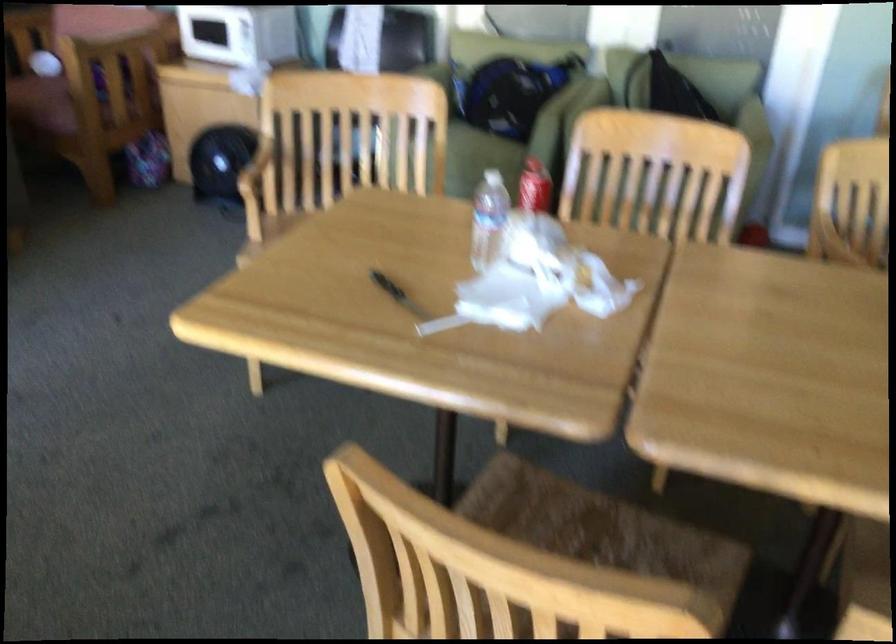
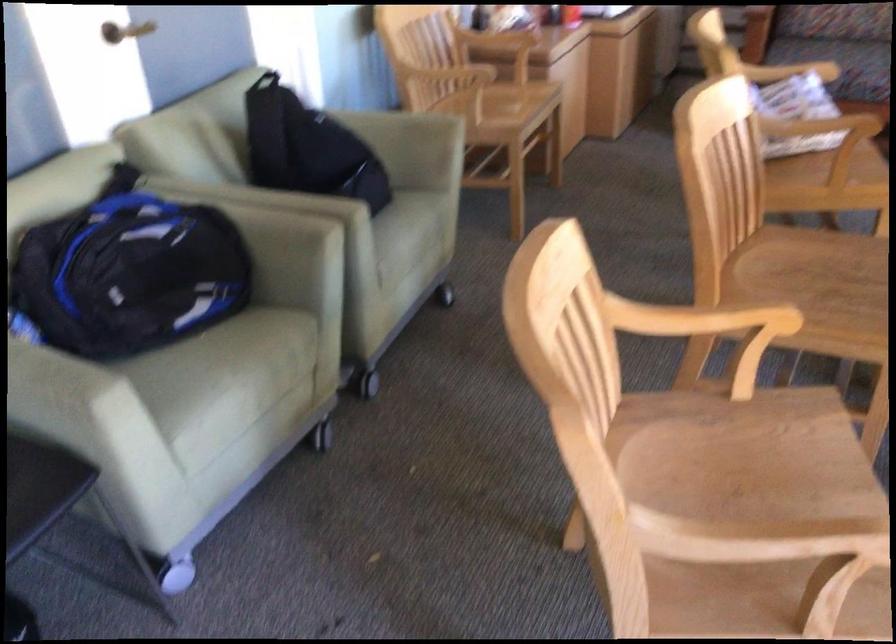
Question: I am providing you with two images of the same scene from different viewpoints. Which of the following objects are not visible in image2?

Choices:
 (A) caster wheel
 (B) chair sitting surface
 (C) blue and black backpack
 (D) small green plate

Answer: (B)